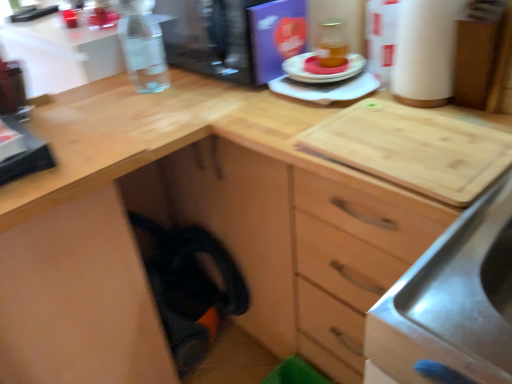
Question: In terms of size, does transparent plastic water bottle at upper left, the first appliance viewed from the top, appear bigger or smaller than clear glass bottle at upper left?

Choices:
 (A) big
 (B) small

Answer: (A)

Question: Is transparent plastic water bottle at upper left, the first appliance viewed from the top, inside the boundaries of clear glass bottle at upper left, or outside?

Choices:
 (A) outside
 (B) inside

Answer: (A)

Question: Based on their relative distances, which object is farther from the clear glass bottle at upper left?

Choices:
 (A) transparent plastic water bottle at upper left, the first appliance viewed from the top
 (B) matte orange cake at center
 (C) white cardboard paper towel at upper right
 (D) matte plastic plate at center, placed as the first appliance when sorted from bottom to top

Answer: (C)

Question: Which object is positioned farthest from the matte orange cake at center?

Choices:
 (A) transparent plastic water bottle at upper left, the first appliance viewed from the top
 (B) clear glass bottle at upper left
 (C) white cardboard paper towel at upper right
 (D) matte plastic plate at center, placed as the first appliance when sorted from bottom to top

Answer: (B)